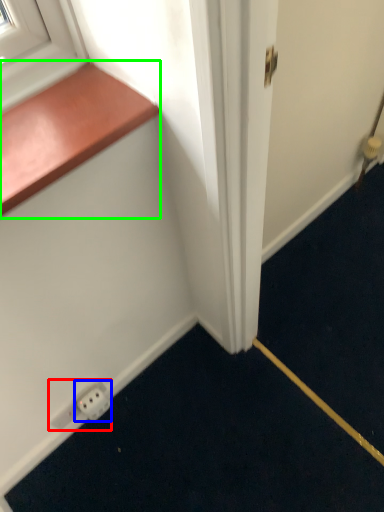
Question: Considering the real-world distances, which object is closest to electric outlet (highlighted by a red box)? electric outlet (highlighted by a blue box) or window sill (highlighted by a green box).

Choices:
 (A) electric outlet
 (B) window sill

Answer: (A)